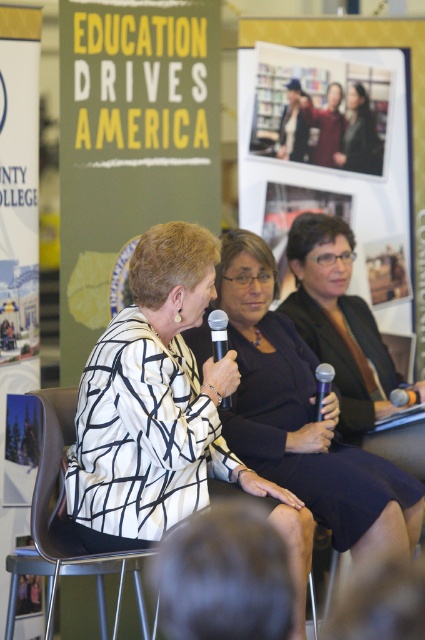
You are organizing a photoshoot and need to place a small prop between the black textured dress at center and the dark brown leather jacket at upper center. Given the distance between them is 3.48 feet, will a 1.5 feet long prop fit without overlapping either object?

The distance between the black textured dress at center and the dark brown leather jacket at upper center is 3.48 feet. A 1.5 feet long prop placed between them would fit since 1.5 is less than 3.48, leaving enough space on both sides.

You are attending the panel discussion and want to read the white paper poster at left while sitting on the brown plastic chair at center. Can you read it comfortably without standing up?

The white paper poster at left is much taller than the brown plastic chair at center, so you would need to stand up to read it comfortably.